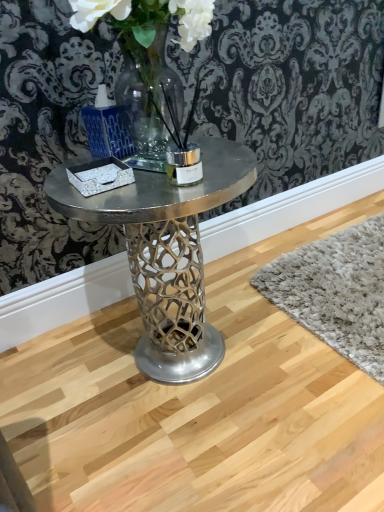
The image size is (384, 512). In order to click on vacant space to the left of metallic silver table at center in this screenshot , I will do `click(49, 385)`.